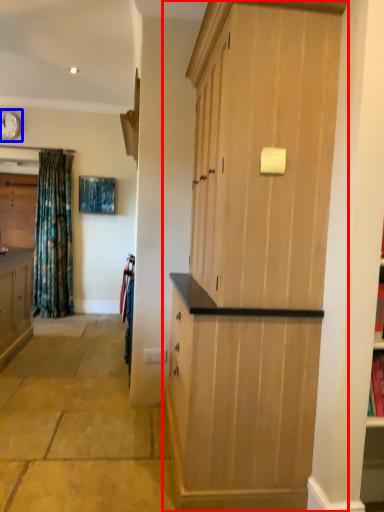
Question: Which object is closer to the camera taking this photo, cupboard (highlighted by a red box) or clock (highlighted by a blue box)?

Choices:
 (A) cupboard
 (B) clock

Answer: (A)